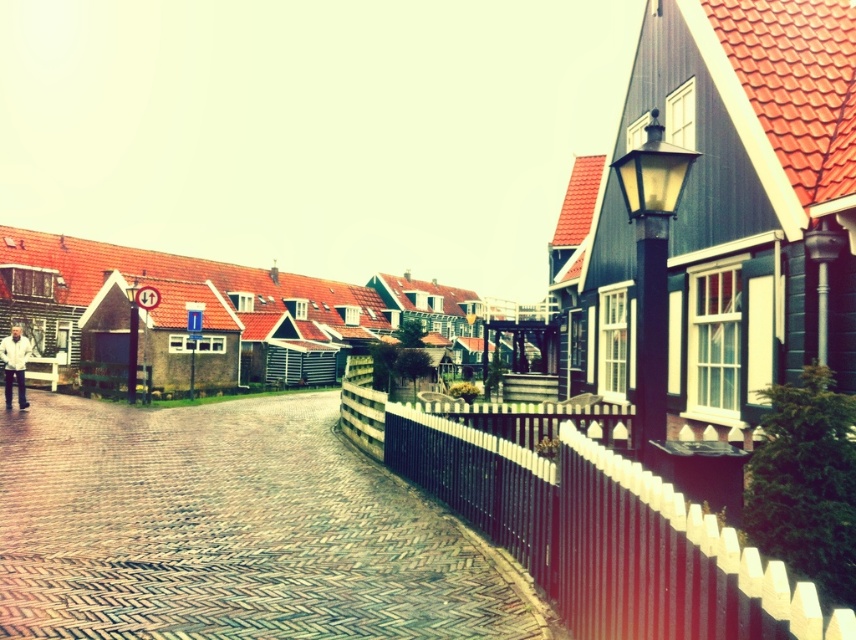
What are the coordinates of the brown brick path at center?

The coordinates of the brown brick path at center are at point (229, 529).

You are a painter setting up an easel to paint the street scene. You notice the black wooden fence at right and the white matte jacket at left. Which object should you focus on if you want to paint the larger one?

The white matte jacket at left is larger than the black wooden fence at right, so you should focus on painting the white matte jacket at left.

You are a delivery person who needs to place a package between the black wooden fence at right and the white matte jacket at left. The package is 40 feet long. Can you fit it between them?

The black wooden fence at right and white matte jacket at left are 39.53 feet apart from each other. Since the package is 40 feet long, it cannot fit between them as there is insufficient space.